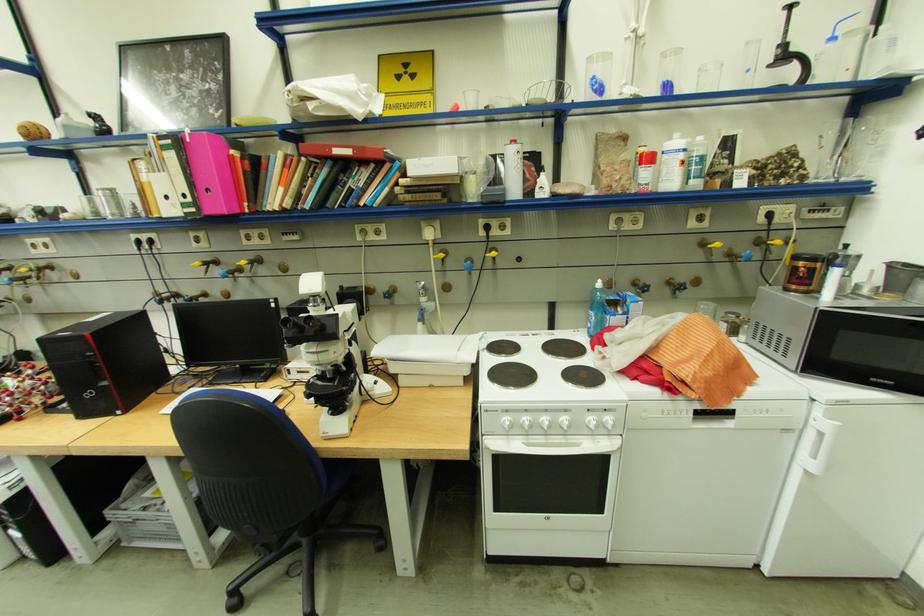
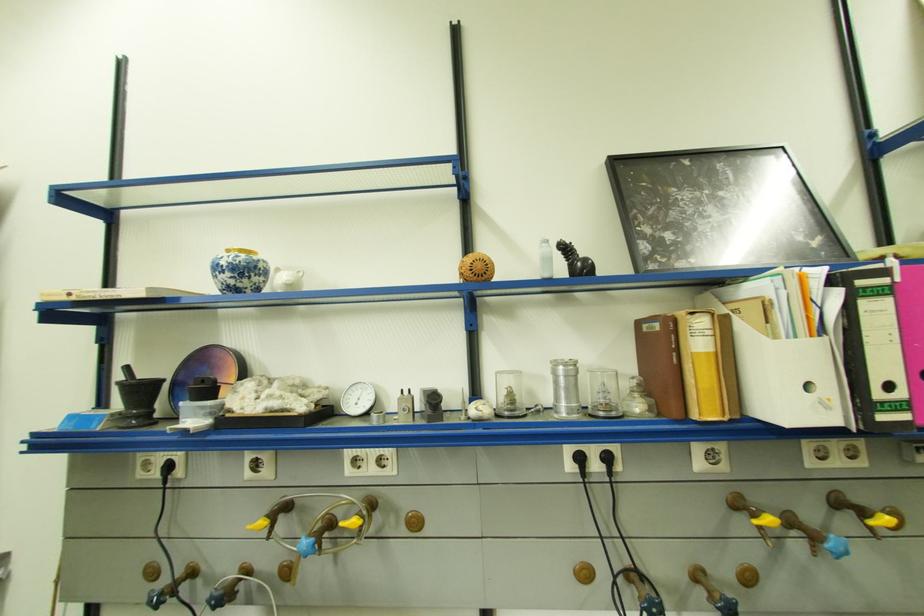
What movement of the cameraman would produce the second image?

The cameraman walked toward left, forward.